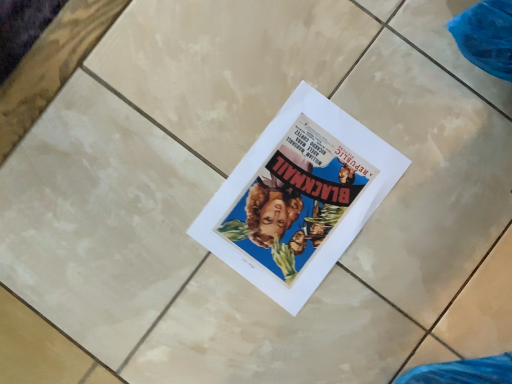
This screenshot has height=384, width=512. I want to click on empty space that is ontop of matte paper poster at center, so click(300, 201).